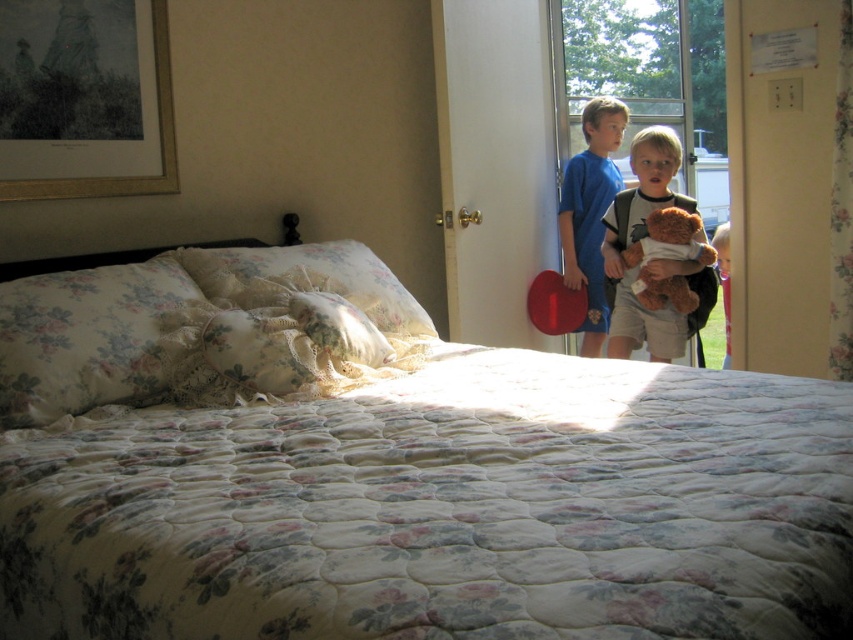
You are organizing a teddy bear hunt in the bedroom and need to place both the brown plush bear at center and the brown plush teddy bear at center. Which one should you place higher up on the shelf to ensure stability?

The brown plush bear at center is much taller than the brown plush teddy bear at center, so placing the taller brown plush bear at center higher up on the shelf would provide better stability.

Based on the photo, you are organizing a childrens room and see both the brown plush bear at center and the brown plush teddy bear at center. Which one is closer to you?

The brown plush bear at center is closer to you because it is in front of the brown plush teddy bear at center.